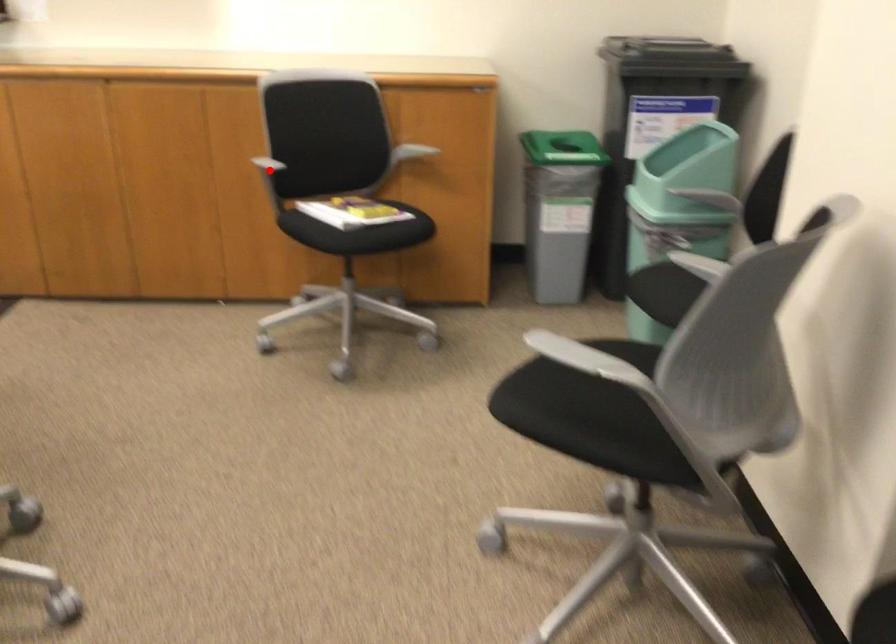
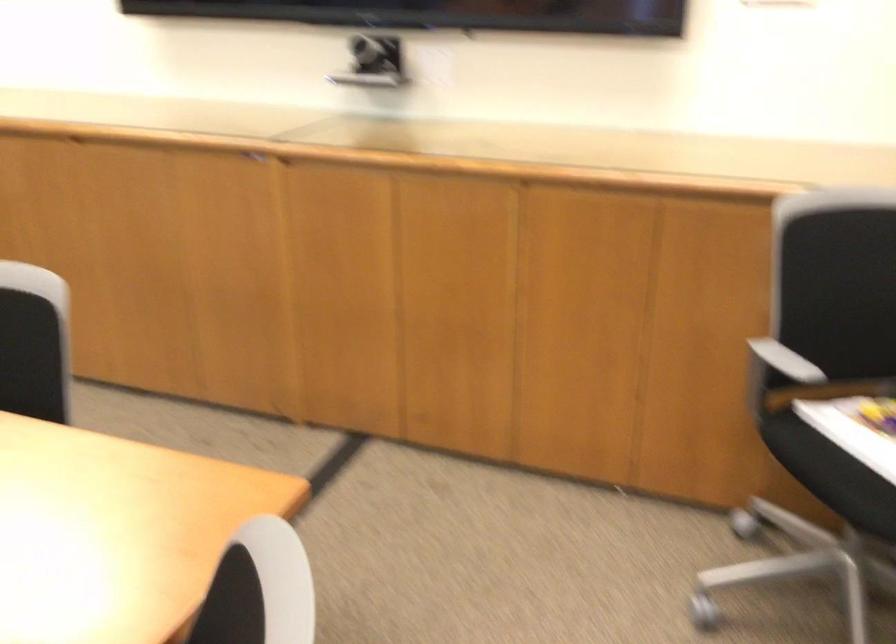
Locate, in the second image, the point that corresponds to the highlighted location in the first image.

(778, 374)